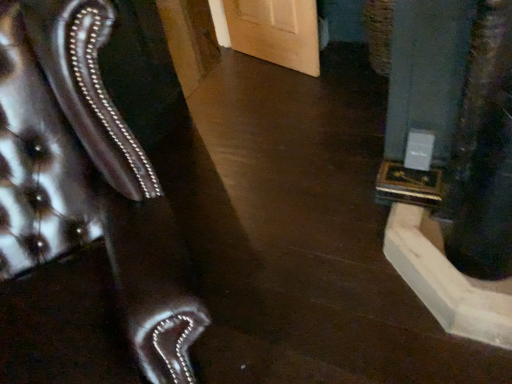
Question: Considering the positions of gray concrete pillar at right and leather-like brown armchair at left in the image, is gray concrete pillar at right bigger or smaller than leather-like brown armchair at left?

Choices:
 (A) big
 (B) small

Answer: (B)

Question: From a real-world perspective, is gray concrete pillar at right physically located above or below leather-like brown armchair at left?

Choices:
 (A) below
 (B) above

Answer: (A)

Question: From the image's perspective, is gray concrete pillar at right positioned above or below leather-like brown armchair at left?

Choices:
 (A) below
 (B) above

Answer: (B)

Question: Is leather-like brown armchair at left in front of or behind gray concrete pillar at right in the image?

Choices:
 (A) behind
 (B) front

Answer: (B)

Question: From the image's perspective, relative to gray concrete pillar at right, is leather-like brown armchair at left above or below?

Choices:
 (A) below
 (B) above

Answer: (A)

Question: Based on their positions, is leather-like brown armchair at left located to the left or right of gray concrete pillar at right?

Choices:
 (A) right
 (B) left

Answer: (B)

Question: Considering the positions of leather-like brown armchair at left and gray concrete pillar at right in the image, is leather-like brown armchair at left taller or shorter than gray concrete pillar at right?

Choices:
 (A) short
 (B) tall

Answer: (B)